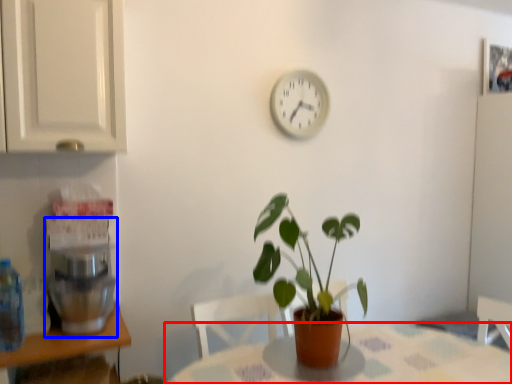
Question: Which point is further to the camera, table (highlighted by a red box) or coffee machine (highlighted by a blue box)?

Choices:
 (A) table
 (B) coffee machine

Answer: (B)